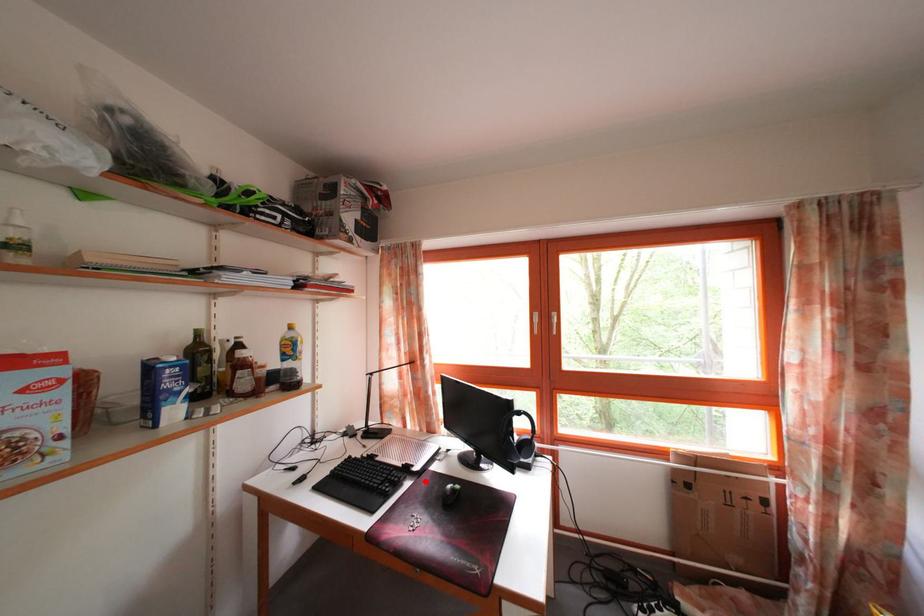
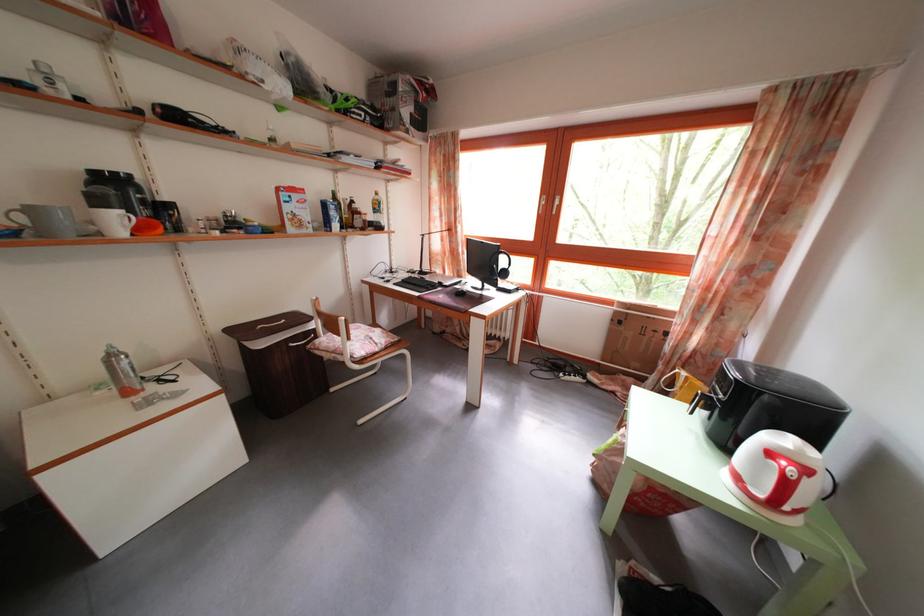
In the second image, find the point that corresponds to the highlighted location in the first image.

(454, 294)